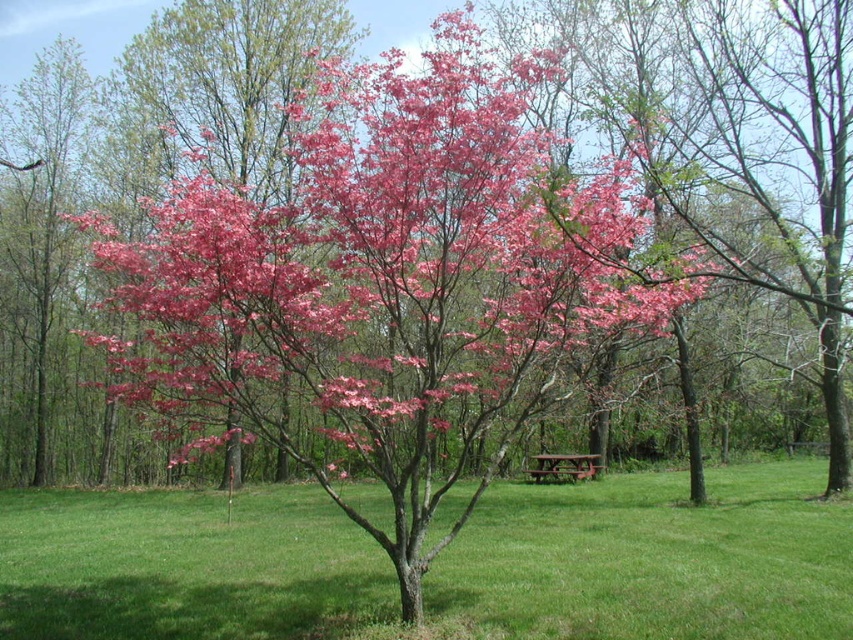
Question: Which of the following is the farthest from the observer?

Choices:
 (A) (628, 611)
 (B) (543, 465)
 (C) (28, 314)

Answer: (C)

Question: Estimate the real-world distances between objects in this image. Which object is closer to the pink matte tree at left?

Choices:
 (A) pink matte tree bloom at center
 (B) wooden park bench at center
 (C) green grass at center

Answer: (A)

Question: Considering the relative positions of pink matte tree bloom at center and wooden park bench at center in the image provided, where is pink matte tree bloom at center located with respect to wooden park bench at center?

Choices:
 (A) below
 (B) above

Answer: (B)

Question: Which object is positioned closest to the pink matte tree bloom at center?

Choices:
 (A) pink glossy tree at center
 (B) wooden park bench at center

Answer: (A)

Question: Observing the image, what is the correct spatial positioning of green grass at center in reference to pink matte tree at left?

Choices:
 (A) below
 (B) above

Answer: (A)

Question: Can you confirm if green grass at center is positioned below pink glossy tree at center?

Choices:
 (A) yes
 (B) no

Answer: (A)